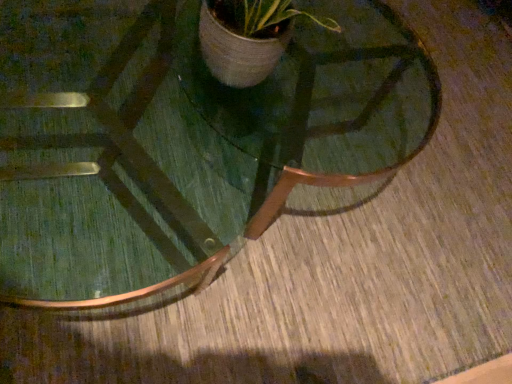
Question: From a real-world perspective, is green glass coffee table at center located beneath green wood table at center?

Choices:
 (A) no
 (B) yes

Answer: (B)

Question: From the image's perspective, does green glass coffee table at center appear lower than green wood table at center?

Choices:
 (A) yes
 (B) no

Answer: (A)

Question: Is green glass coffee table at center smaller than green wood table at center?

Choices:
 (A) no
 (B) yes

Answer: (A)

Question: Does green glass coffee table at center have a lesser height compared to green wood table at center?

Choices:
 (A) no
 (B) yes

Answer: (A)

Question: Is green glass coffee table at center at the left side of green wood table at center?

Choices:
 (A) no
 (B) yes

Answer: (B)

Question: From a real-world perspective, is green glass coffee table at center on top of green wood table at center?

Choices:
 (A) no
 (B) yes

Answer: (A)

Question: Can you confirm if green wood table at center is positioned to the left of green glass coffee table at center?

Choices:
 (A) no
 (B) yes

Answer: (A)

Question: Is green wood table at center positioned before green glass coffee table at center?

Choices:
 (A) yes
 (B) no

Answer: (A)

Question: Is green wood table at center at the right side of green glass coffee table at center?

Choices:
 (A) yes
 (B) no

Answer: (A)

Question: Is green wood table at center outside of green glass coffee table at center?

Choices:
 (A) no
 (B) yes

Answer: (B)

Question: Considering the relative sizes of green wood table at center and green glass coffee table at center in the image provided, is green wood table at center bigger than green glass coffee table at center?

Choices:
 (A) yes
 (B) no

Answer: (B)

Question: From a real-world perspective, is green wood table at center under green glass coffee table at center?

Choices:
 (A) no
 (B) yes

Answer: (A)

Question: Would you say green glass coffee table at center is inside or outside green wood table at center?

Choices:
 (A) inside
 (B) outside

Answer: (B)